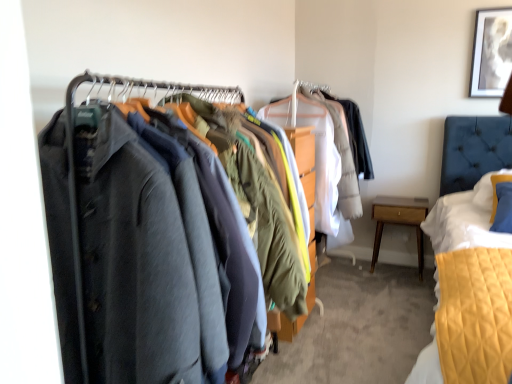
Question: Is white paper at upper right to the left or to the right of light wood/finely crafted nightstand at lower right in the image?

Choices:
 (A) left
 (B) right

Answer: (B)

Question: From a real-world perspective, is white paper at upper right positioned above or below light wood/finely crafted nightstand at lower right?

Choices:
 (A) above
 (B) below

Answer: (A)

Question: Which of these objects is positioned closest to the white paper at upper right?

Choices:
 (A) matte black coat at left
 (B) light wood/finely crafted nightstand at lower right

Answer: (B)

Question: Which object is the closest to the light wood/finely crafted nightstand at lower right?

Choices:
 (A) white paper at upper right
 (B) matte black coat at left

Answer: (A)